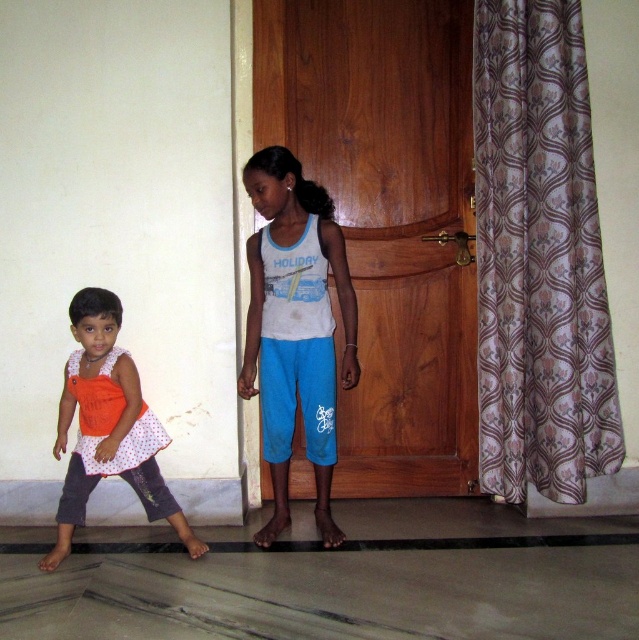
Question: Which object is the closest to the floral-patterned fabric at right?

Choices:
 (A) white cotton tank top at center
 (B) orange dotted dress at lower left

Answer: (A)

Question: Is wooden door at center positioned in front of orange dotted dress at lower left?

Choices:
 (A) no
 (B) yes

Answer: (A)

Question: Among these points, which one is nearest to the camera?

Choices:
 (A) (305, 380)
 (B) (144, 508)
 (C) (594, 461)

Answer: (B)

Question: Is floral-patterned fabric at right above white cotton tank top at center?

Choices:
 (A) no
 (B) yes

Answer: (B)

Question: Considering the relative positions of wooden door at center and orange dotted dress at lower left in the image provided, where is wooden door at center located with respect to orange dotted dress at lower left?

Choices:
 (A) above
 (B) below

Answer: (A)

Question: Which object is the farthest from the floral-patterned fabric at right?

Choices:
 (A) wooden door at center
 (B) white cotton tank top at center

Answer: (B)